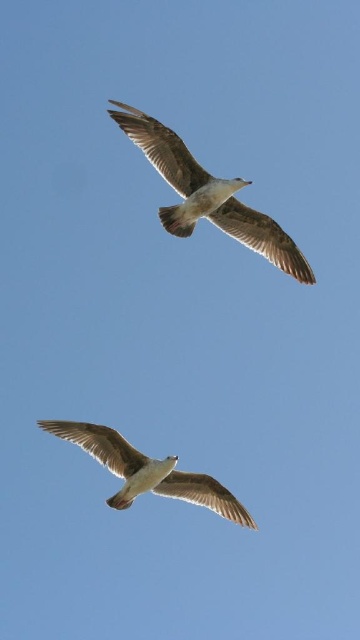
Question: Can you confirm if white feathered bird at upper center is positioned to the left of white feathered bird at center?

Choices:
 (A) no
 (B) yes

Answer: (A)

Question: Is white feathered bird at upper center to the left of white feathered bird at center from the viewer's perspective?

Choices:
 (A) no
 (B) yes

Answer: (A)

Question: Which of the following is the closest to the observer?

Choices:
 (A) (86, 426)
 (B) (153, 136)

Answer: (B)

Question: Is white feathered bird at upper center in front of white feathered bird at center?

Choices:
 (A) no
 (B) yes

Answer: (B)

Question: Which point is farther from the camera taking this photo?

Choices:
 (A) (236, 225)
 (B) (127, 480)

Answer: (B)

Question: Which point appears farthest from the camera in this image?

Choices:
 (A) (128, 458)
 (B) (169, 132)

Answer: (A)